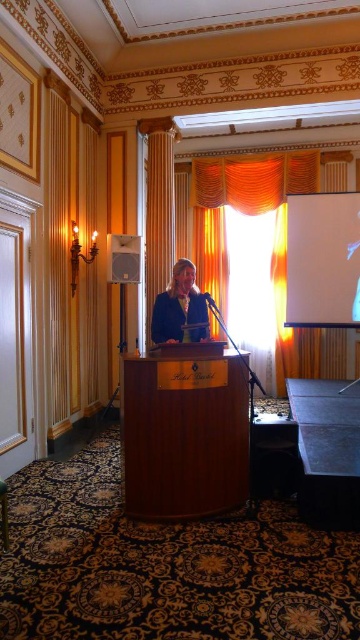
You are an event planner setting up a conference room. You need to place a 3.5 meter long banner between the wooden podium at center and the white glossy projection screen at upper right. Is there enough space to hang the banner without folding it?

The distance between the wooden podium at center and the white glossy projection screen at upper right is 4.02 meters. Since the banner is 3.5 meters long, there is sufficient space to hang it without folding.

You are standing in the Hotel Cecil conference room and want to place a decorative plant on the floor directly behind the wooden podium at center. According to the room layout, where should you position the plant relative to the podium?

The wooden podium at center is positioned at coordinates point (183, 435), so placing the plant directly behind it would mean positioning it along the same x coordinate but further back along the y axis.